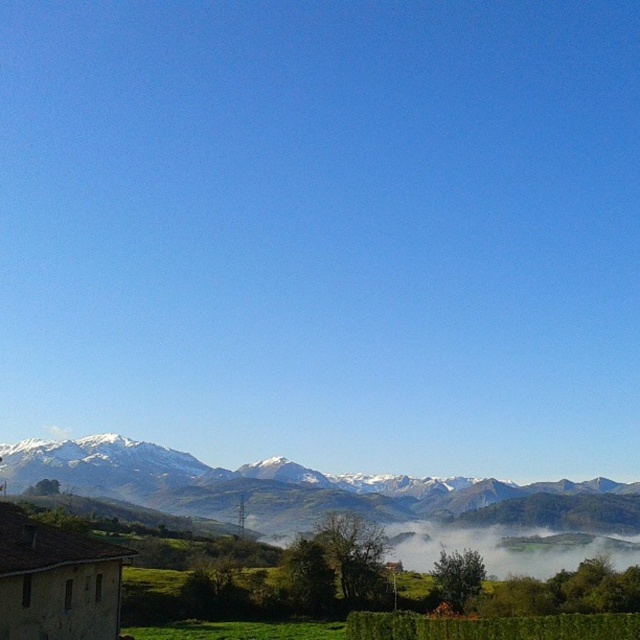
You are standing in the field and want to walk to the point that is closer to the mountains. Which point should you go to, point (292, 465) or point (397, 560)?

Point (397, 560) is closer to the mountains because it is further away from the viewer compared to point (292, 465), which is closer to the viewer.

You are standing in the foreground of the image and want to take a photo of the snowy rocky mountain range at upper center. Based on its 2D location coordinates, where should you aim your camera?

The snowy rocky mountain range at upper center is located at coordinates point (264, 484), so you should aim your camera towards the upper center area of the image to capture it.